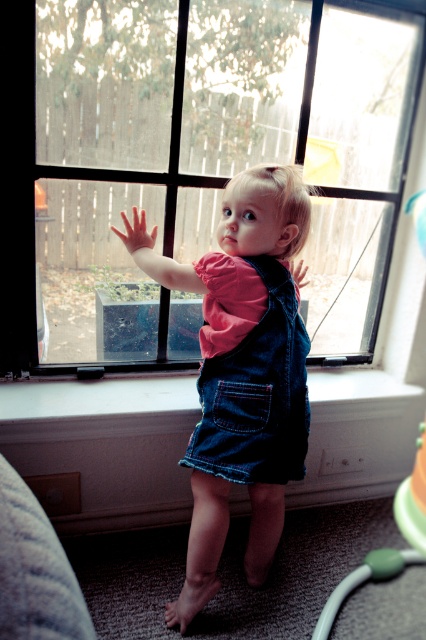
Question: Which of the following is the farthest from the observer?

Choices:
 (A) smooth skin hand at upper right
 (B) white painted wood at lower center
 (C) pink flesh hand at upper center

Answer: (A)

Question: Does clear glass window at center appear under smooth skin hand at upper right?

Choices:
 (A) yes
 (B) no

Answer: (B)

Question: Can you confirm if green rubber toy at lower right is thinner than smooth skin hand at upper right?

Choices:
 (A) no
 (B) yes

Answer: (A)

Question: Which of the following is the farthest from the observer?

Choices:
 (A) denim overall at center
 (B) white painted wood at lower center

Answer: (B)

Question: Is clear glass window at center smaller than green rubber toy at lower right?

Choices:
 (A) no
 (B) yes

Answer: (A)

Question: Which point is farther to the camera?

Choices:
 (A) clear glass window at center
 (B) denim overall at center

Answer: (A)